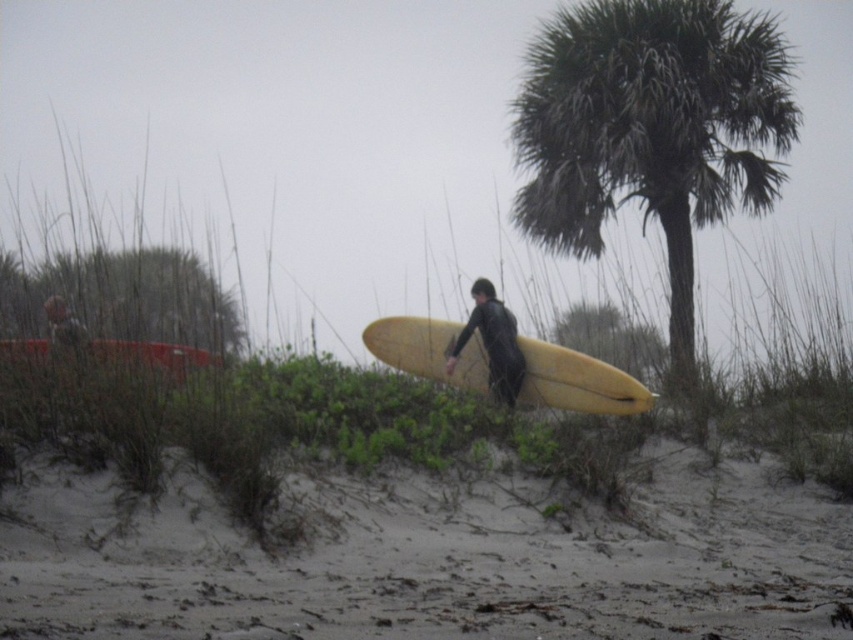
Does green leafy palm tree at upper right have a larger size compared to matte black wetsuit at center?

No.

Consider the image. Does green leafy palm tree at upper right lie in front of matte black wetsuit at center?

No, green leafy palm tree at upper right is behind matte black wetsuit at center.

Image resolution: width=853 pixels, height=640 pixels. In order to click on green leafy palm tree at upper right in this screenshot , I will do `click(651, 129)`.

Can you confirm if matte black wetsuit at center is taller than yellow matte surfboard at lower center?

Yes, matte black wetsuit at center is taller than yellow matte surfboard at lower center.

Consider the image. Who is more forward, (492, 348) or (45, 349)?

Positioned in front is point (45, 349).

You are a GUI agent. You are given a task and a screenshot of the screen. Output one action in this format:
    pyautogui.click(x=<x>, y=<y>)
    Task: Click on the matte black wetsuit at center
    
    Given the screenshot: What is the action you would take?
    coord(492,342)

Is yellow matte surfboard at center smaller than yellow matte surfboard at lower center?

No, yellow matte surfboard at center is not smaller than yellow matte surfboard at lower center.

Does point (463, 346) come in front of point (97, 340)?

No, (463, 346) is further to viewer.

In order to click on yellow matte surfboard at center in this screenshot , I will do `click(577, 381)`.